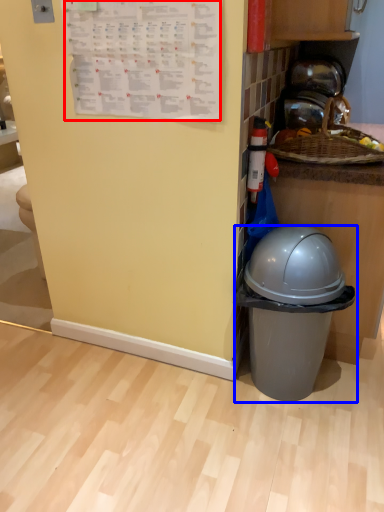
Question: Among these objects, which one is farthest to the camera, writing (highlighted by a red box) or waste container (highlighted by a blue box)?

Choices:
 (A) writing
 (B) waste container

Answer: (B)